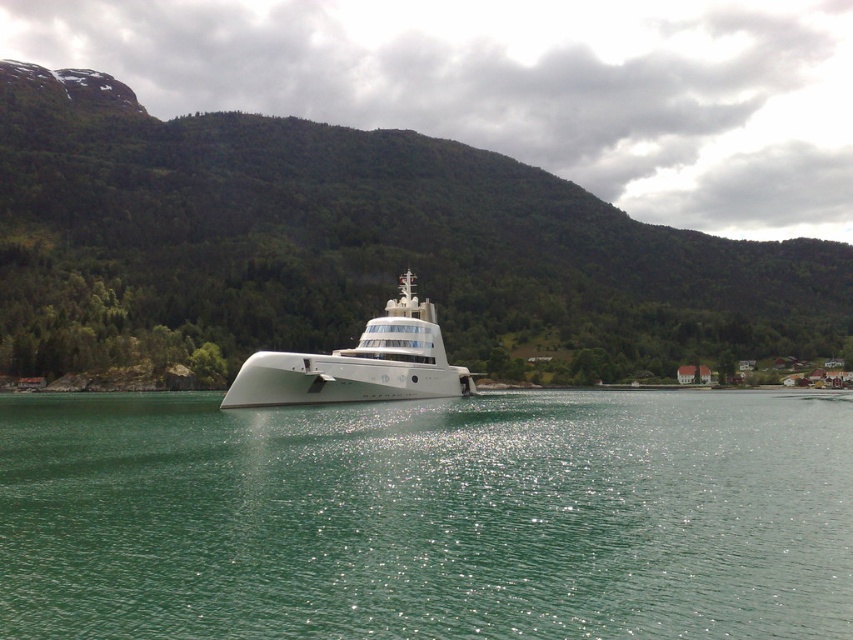
Is green glossy water at center above white glossy cruise ship at center?

No, green glossy water at center is not above white glossy cruise ship at center.

Can you confirm if green glossy water at center is positioned to the left of white glossy cruise ship at center?

Incorrect, green glossy water at center is not on the left side of white glossy cruise ship at center.

At what (x,y) coordinates should I click in order to perform the action: click on green glossy water at center. Please return your answer as a coordinate pair (x, y). Looking at the image, I should click on (428, 516).